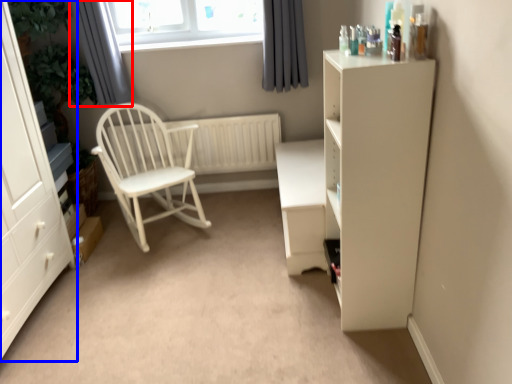
Question: Among these objects, which one is nearest to the camera, curtain (highlighted by a red box) or cabinetry (highlighted by a blue box)?

Choices:
 (A) curtain
 (B) cabinetry

Answer: (B)